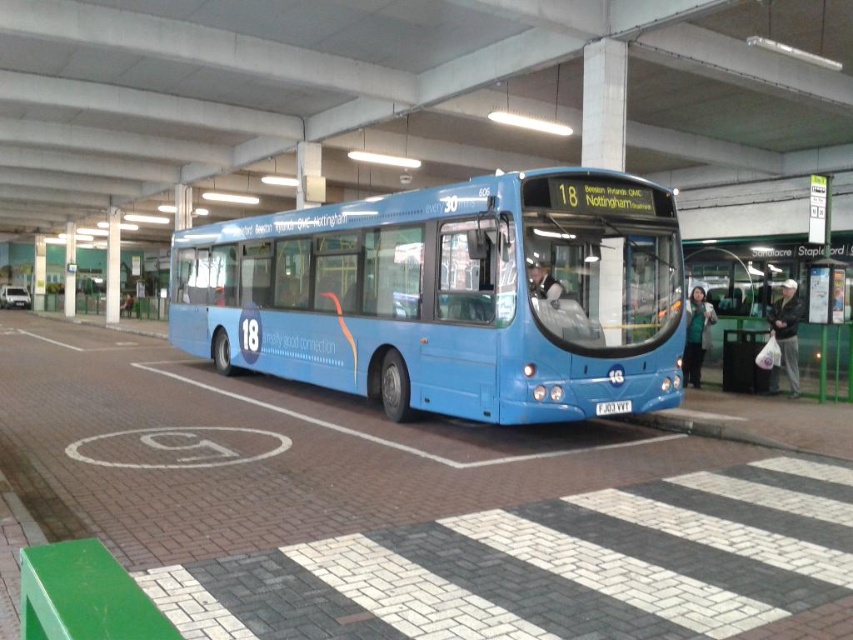
You are a pedestrian standing at the bus station and want to board the matte blue bus at center. The green plastic bus stop at center is where you need to wait for the bus. Which one is closer to you right now?

The matte blue bus at center is closer to you than the green plastic bus stop at center because it is positioned nearer to the viewer.

You are standing at the bus stop marked with a circular symbol containing the letter G. You want to board the matte blue bus at center. In which direction should you walk relative to your current position?

The matte blue bus at center is located at coordinates point (x=451, y=296). Since you are at the G marked stop, you should walk towards the center area where the bus is parked.

You are a bus driver who needs to park your matte blue bus at center in the correct spot. The green plastic bus stop at center has a height restriction. Can your bus fit under it without any issues?

The matte blue bus at center is not as tall as the green plastic bus stop at center, so it can fit under it without any issues.